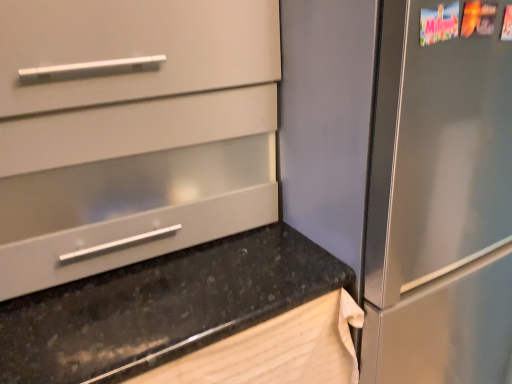
Question: Do you think matte white drawer at center is within black granite countertop at lower left, or outside of it?

Choices:
 (A) outside
 (B) inside

Answer: (A)

Question: Is matte white drawer at center in front of or behind black granite countertop at lower left in the image?

Choices:
 (A) front
 (B) behind

Answer: (B)

Question: Is matte white drawer at center taller or shorter than black granite countertop at lower left?

Choices:
 (A) tall
 (B) short

Answer: (B)

Question: In terms of size, does black granite countertop at lower left appear bigger or smaller than matte white drawer at center?

Choices:
 (A) big
 (B) small

Answer: (A)

Question: In the image, is black granite countertop at lower left positioned in front of or behind matte white drawer at center?

Choices:
 (A) front
 (B) behind

Answer: (A)

Question: Which is correct: black granite countertop at lower left is inside matte white drawer at center, or outside of it?

Choices:
 (A) inside
 (B) outside

Answer: (B)

Question: In terms of width, does black granite countertop at lower left look wider or thinner when compared to matte white drawer at center?

Choices:
 (A) wide
 (B) thin

Answer: (A)